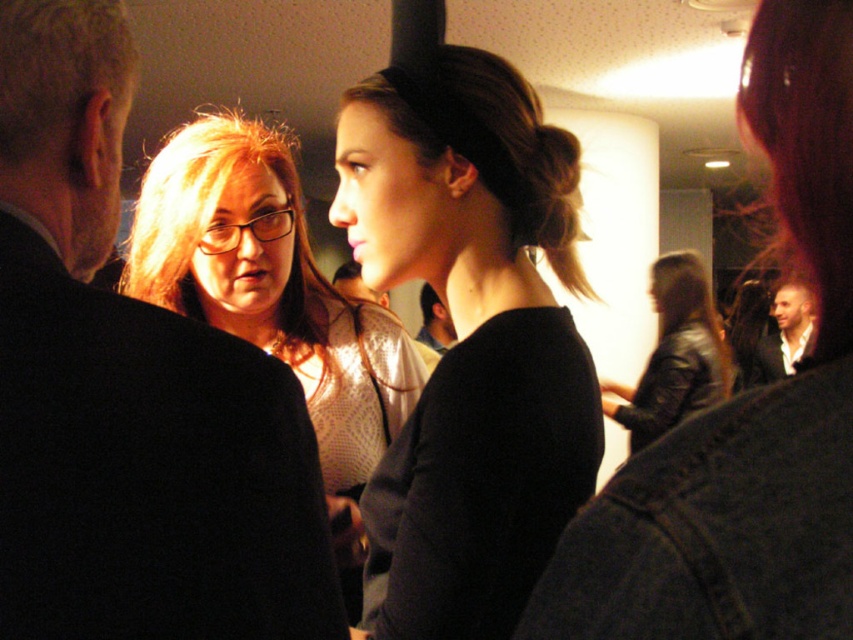
Based on the scene description, where exactly is the black matte shirt at center located in the image?

The black matte shirt at center is located at point coordinates of 0.534 on the x axis and 0.552 on the y axis.

You are at a party and want to find the black matte shirt at center. According to the image coordinates, where exactly is it located?

The black matte shirt at center is located at coordinates point (x=469, y=340).

You are standing in the middle of the room and see two points marked in the image. Which point is closer to you, point (x=445, y=470) or point (x=811, y=378)?

Point (x=445, y=470) is closer to you because it is further to the viewer than point (x=811, y=378).